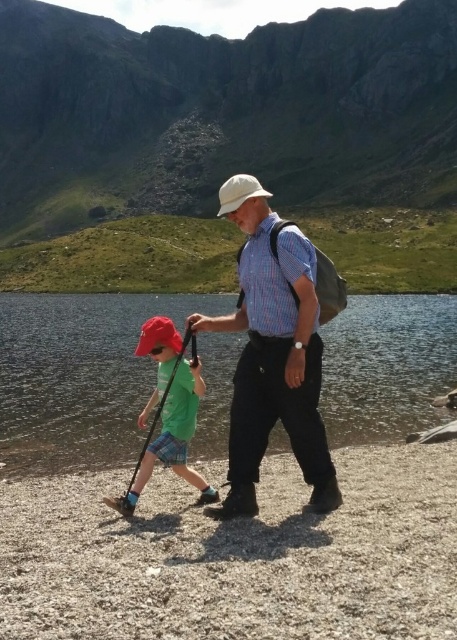
Question: Is clear water at lower center closer to camera compared to plaid cotton shirt at center?

Choices:
 (A) yes
 (B) no

Answer: (B)

Question: Does plaid cotton shirt at center appear over white matte baseball hat at center?

Choices:
 (A) no
 (B) yes

Answer: (A)

Question: Considering the relative positions of smooth gravel shore at lower center and white matte baseball hat at center in the image provided, where is smooth gravel shore at lower center located with respect to white matte baseball hat at center?

Choices:
 (A) above
 (B) below

Answer: (B)

Question: Among these objects, which one is farthest from the camera?

Choices:
 (A) clear water at lower center
 (B) smooth gravel shore at lower center
 (C) white matte baseball hat at center

Answer: (C)

Question: Which of the following is the farthest from the observer?

Choices:
 (A) white matte baseball hat at center
 (B) green matte shirt at center
 (C) smooth gravel shore at lower center
 (D) plaid cotton shirt at center

Answer: (A)

Question: Among these objects, which one is nearest to the camera?

Choices:
 (A) plaid cotton shirt at center
 (B) smooth gravel shore at lower center
 (C) white matte baseball hat at center

Answer: (B)